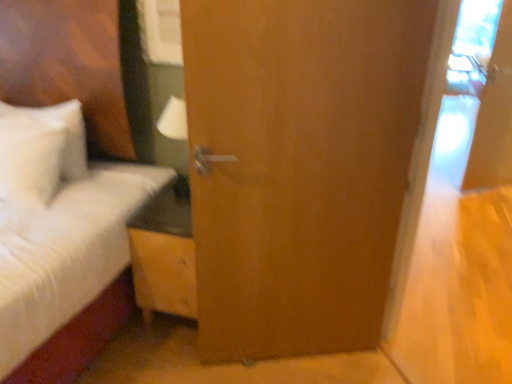
You are a GUI agent. You are given a task and a screenshot of the screen. Output one action in this format:
    pyautogui.click(x=<x>, y=<y>)
    Task: Click on the wooden door at center
    The width and height of the screenshot is (512, 384).
    Given the screenshot: What is the action you would take?
    coord(298,166)

Which is behind, point (3, 329) or point (153, 267)?

The point (153, 267) is more distant.

Is white fluffy bed at left at the right side of wooden nightstand at center?

No, white fluffy bed at left is not to the right of wooden nightstand at center.

Is white fluffy bed at left looking in the opposite direction of wooden nightstand at center?

white fluffy bed at left is not turned away from wooden nightstand at center.

From the image's perspective, relative to wooden nightstand at center, is white fluffy bed at left above or below?

white fluffy bed at left is above wooden nightstand at center.

Consider the image. How different are the orientations of wooden door at center and wooden nightstand at center in degrees?

wooden door at center and wooden nightstand at center are facing 21.2 degrees away from each other.

Is wooden door at center far away from wooden nightstand at center?

They are positioned close to each other.

From the image's perspective, between wooden door at center and wooden nightstand at center, who is located below?

wooden nightstand at center is shown below in the image.

Looking at this image, looking at the image, does wooden door at center seem bigger or smaller compared to wooden nightstand at center?

wooden door at center is bigger than wooden nightstand at center.

In terms of height, does wooden nightstand at center look taller or shorter compared to wooden door at center?

Clearly, wooden nightstand at center is shorter compared to wooden door at center.

Considering the sizes of wooden nightstand at center and wooden door at center in the image, is wooden nightstand at center wider or thinner than wooden door at center?

In the image, wooden nightstand at center appears to be wider than wooden door at center.

Is wooden nightstand at center to the left or to the right of wooden door at center in the image?

wooden nightstand at center is to the left of wooden door at center.

From the image's perspective, is white fluffy bed at left over wooden door at center?

No, from the image's perspective, white fluffy bed at left is not above wooden door at center.

Does point (3, 219) appear closer or farther from the camera than point (366, 7)?

Point (3, 219).

From a real-world perspective, is white fluffy bed at left located higher than wooden door at center?

No, from a real-world perspective, white fluffy bed at left is not above wooden door at center.

Can you tell me how much white fluffy bed at left and wooden door at center differ in facing direction?

27.3 degrees.

From a real-world perspective, is wooden nightstand at center under white fluffy bed at left?

Yes, from a real-world perspective, wooden nightstand at center is under white fluffy bed at left.

Considering the sizes of wooden nightstand at center and white fluffy bed at left in the image, is wooden nightstand at center wider or thinner than white fluffy bed at left?

Clearly, wooden nightstand at center has less width compared to white fluffy bed at left.

Consider the image. Between wooden nightstand at center and white fluffy bed at left, which one has more height?

white fluffy bed at left is taller.

Measure the distance between wooden nightstand at center and white fluffy bed at left.

A distance of 10.74 inches exists between wooden nightstand at center and white fluffy bed at left.

Would you say wooden door at center is inside or outside white fluffy bed at left?

wooden door at center is located beyond the bounds of white fluffy bed at left.

Is wooden door at center facing away from white fluffy bed at left?

No.

From a real-world perspective, who is located higher, wooden door at center or white fluffy bed at left?

From a 3D spatial view, wooden door at center is above.

Which is more to the left, wooden door at center or white fluffy bed at left?

white fluffy bed at left.

Image resolution: width=512 pixels, height=384 pixels. What are the coordinates of `bed on the left of wooden nightstand at center` in the screenshot? It's located at (60, 239).

I want to click on nightstand below the wooden door at center (from the image's perspective), so click(x=164, y=257).

Based on their spatial positions, is wooden door at center or white fluffy bed at left closer to wooden nightstand at center?

white fluffy bed at left.

Which object lies nearer to the anchor point wooden nightstand at center, white fluffy bed at left or wooden door at center?

white fluffy bed at left.

Looking at the image, which one is located closer to wooden door at center, white fluffy bed at left or wooden nightstand at center?

wooden nightstand at center lies closer to wooden door at center than the other object.

Looking at this image, which object lies nearer to the anchor point wooden door at center, wooden nightstand at center or white fluffy bed at left?

Among the two, wooden nightstand at center is located nearer to wooden door at center.

Considering their positions, is wooden nightstand at center positioned closer to white fluffy bed at left than wooden door at center?

wooden nightstand at center is closer to white fluffy bed at left.

Estimate the real-world distances between objects in this image. Which object is further from white fluffy bed at left, wooden door at center or wooden nightstand at center?

Based on the image, wooden door at center appears to be further to white fluffy bed at left.

Locate an element on the screen. The height and width of the screenshot is (384, 512). nightstand between white fluffy bed at left and wooden door at center is located at coordinates (164, 257).